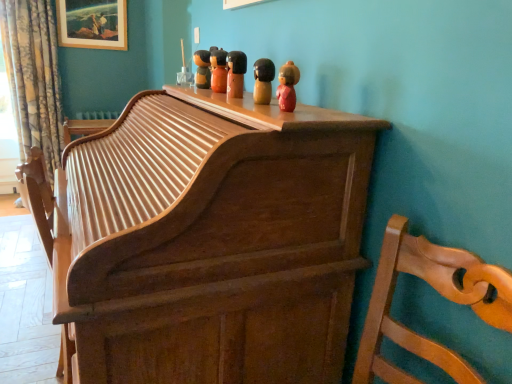
Question: Choose the correct answer: Is wooden figurine at upper center, placed as the 5th toy when sorted from back to front, inside floral fabric curtain at left or outside it?

Choices:
 (A) inside
 (B) outside

Answer: (B)

Question: Is wooden figurine at upper center, which is counted as the first toy, starting from the front, wider or thinner than floral fabric curtain at left?

Choices:
 (A) wide
 (B) thin

Answer: (B)

Question: Estimate the real-world distances between objects in this image. Which object is farther from the wooden doll at upper center, positioned as the 5th toy in right-to-left order?

Choices:
 (A) wooden picture frame at upper left
 (B) floral fabric curtain at left
 (C) wooden figurine at center, the 4th toy from the back
 (D) matte wooden doll at center, the 4th toy positioned from the front
 (E) wooden figurine at upper center, the first toy positioned from the right

Answer: (B)

Question: Which is farther from the matte black figurine at upper center, which appears as the third toy when viewed from the left?

Choices:
 (A) wooden figurine at center, the 4th toy from the left
 (B) wooden figurine at upper center, placed as the 5th toy when sorted from back to front
 (C) floral fabric curtain at left
 (D) wooden chair at right
 (E) matte wooden doll at center, acting as the second toy starting from the left

Answer: (C)